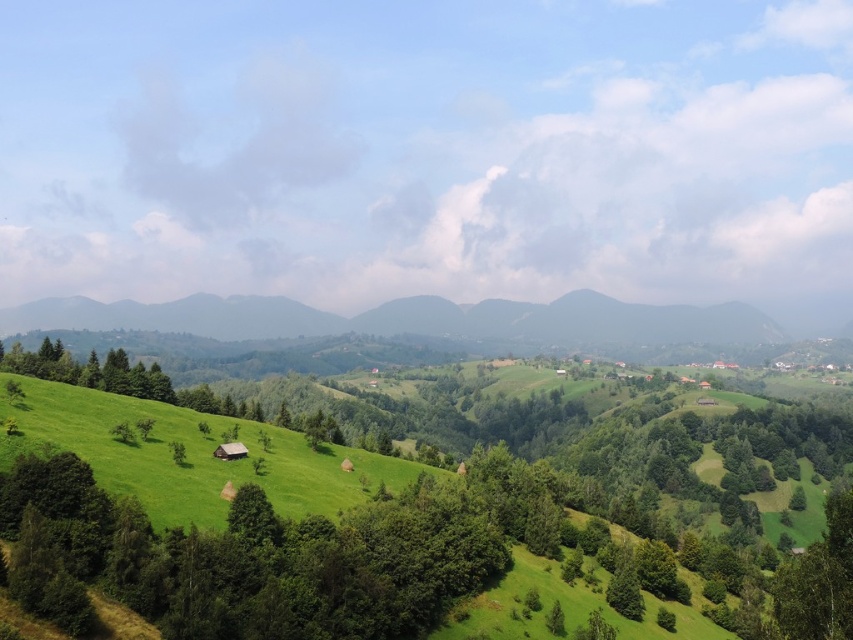
Question: Is green leafy tree at center below green grassy field at lower left?

Choices:
 (A) yes
 (B) no

Answer: (A)

Question: Where is green leafy tree at center located in relation to green grassy field at lower left in the image?

Choices:
 (A) left
 (B) right

Answer: (B)

Question: Among these points, which one is farthest from the camera?

Choices:
 (A) (161, 442)
 (B) (206, 467)

Answer: (A)

Question: From the image, what is the correct spatial relationship of green leafy tree at center in relation to green grassy field at lower left?

Choices:
 (A) above
 (B) below

Answer: (B)